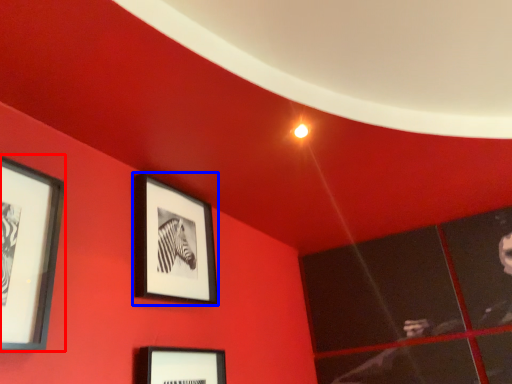
Question: Which object is further to the camera taking this photo, picture frame (highlighted by a red box) or picture frame (highlighted by a blue box)?

Choices:
 (A) picture frame
 (B) picture frame

Answer: (B)